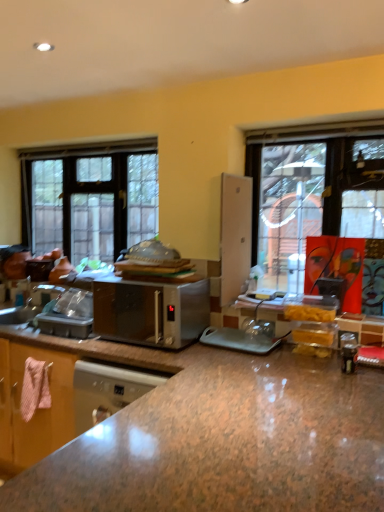
Question: Does satin silver microwave at center have a greater height compared to brown granite countertop at center?

Choices:
 (A) no
 (B) yes

Answer: (A)

Question: From a real-world perspective, is satin silver microwave at center located higher than brown granite countertop at center?

Choices:
 (A) yes
 (B) no

Answer: (A)

Question: Considering the relative positions of satin silver microwave at center and brown granite countertop at center in the image provided, is satin silver microwave at center to the left of brown granite countertop at center from the viewer's perspective?

Choices:
 (A) no
 (B) yes

Answer: (B)

Question: Does satin silver microwave at center come in front of brown granite countertop at center?

Choices:
 (A) no
 (B) yes

Answer: (A)

Question: From the image's perspective, is satin silver microwave at center under brown granite countertop at center?

Choices:
 (A) yes
 (B) no

Answer: (B)

Question: From a real-world perspective, is satin silver microwave at center above or below brown granite countertop at center?

Choices:
 (A) above
 (B) below

Answer: (A)

Question: Is point (175, 307) positioned closer to the camera than point (347, 441)?

Choices:
 (A) farther
 (B) closer

Answer: (A)

Question: Relative to brown granite countertop at center, is satin silver microwave at center in front or behind?

Choices:
 (A) front
 (B) behind

Answer: (B)

Question: From the image's perspective, is satin silver microwave at center above or below brown granite countertop at center?

Choices:
 (A) above
 (B) below

Answer: (A)

Question: Based on their sizes in the image, would you say brown granite countertop at center is bigger or smaller than satin silver microwave at center?

Choices:
 (A) big
 (B) small

Answer: (A)

Question: Is point (322, 461) closer or farther from the camera than point (170, 331)?

Choices:
 (A) farther
 (B) closer

Answer: (B)

Question: From the image's perspective, is brown granite countertop at center above or below satin silver microwave at center?

Choices:
 (A) below
 (B) above

Answer: (A)

Question: Is brown granite countertop at center in front of or behind satin silver microwave at center in the image?

Choices:
 (A) front
 (B) behind

Answer: (A)

Question: Choose the correct answer: Is clear glass window at left inside satin silver microwave at center or outside it?

Choices:
 (A) inside
 (B) outside

Answer: (B)

Question: From a real-world perspective, is clear glass window at left positioned above or below satin silver microwave at center?

Choices:
 (A) below
 (B) above

Answer: (B)